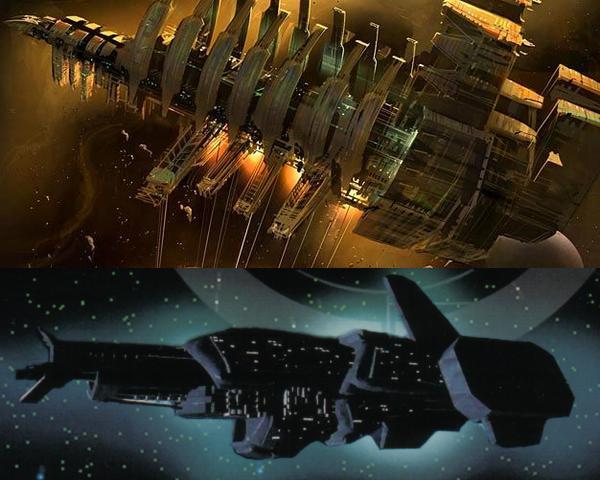
Identify the location of circular shape light. Image resolution: width=600 pixels, height=480 pixels. click(527, 301).